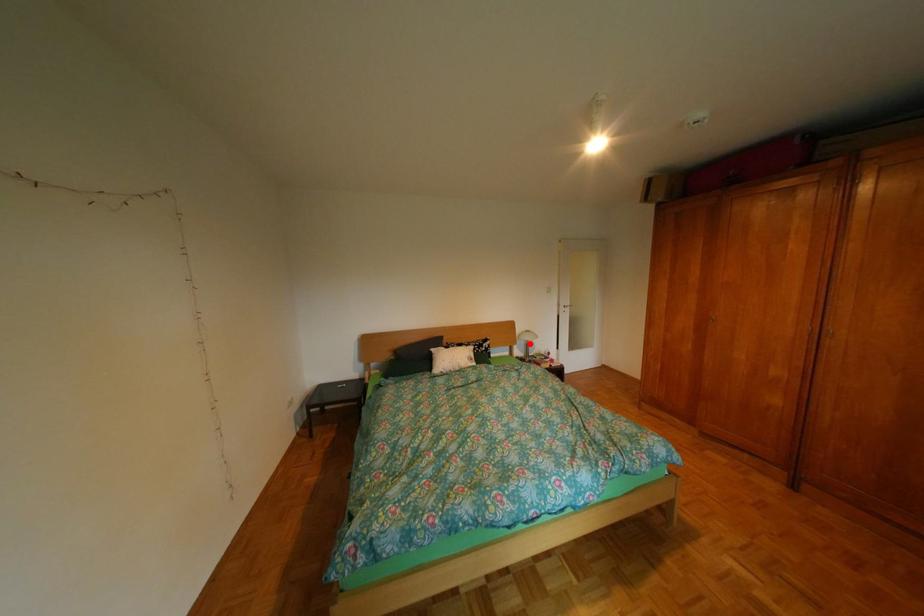
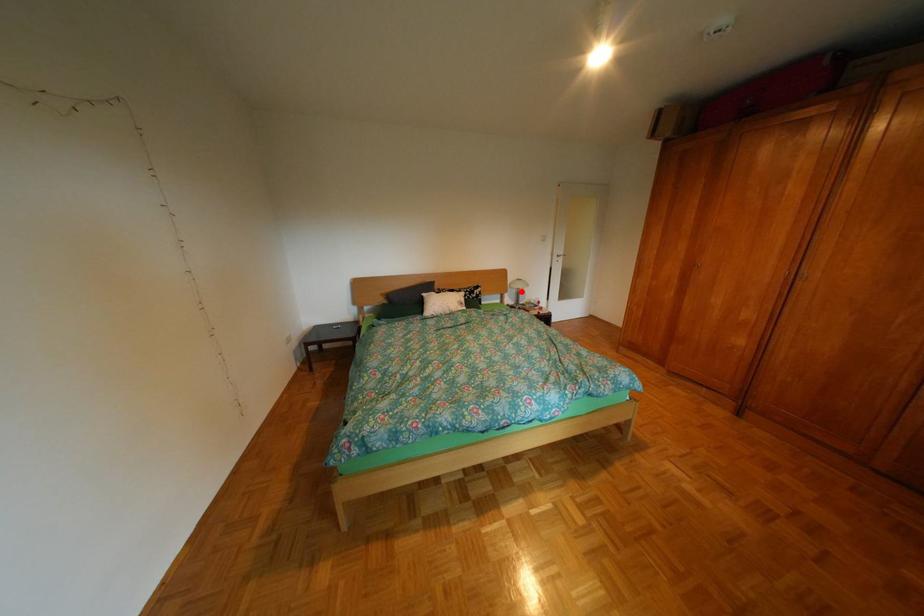
I am providing you with two images of the same scene from different viewpoints. A red point is marked on the first image and another point is marked on the second image. Is the marked point in image1 the same physical position as the marked point in image2?

Yes